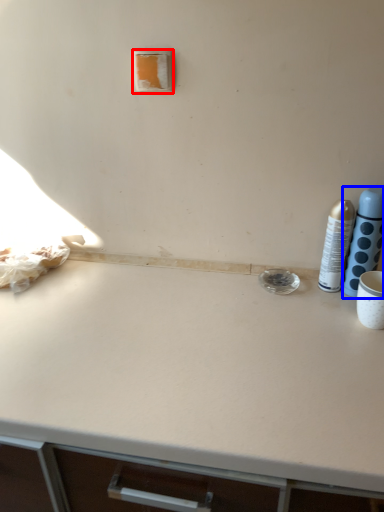
Question: Which object appears closest to the camera in this image, light switch (highlighted by a red box) or bottle (highlighted by a blue box)?

Choices:
 (A) light switch
 (B) bottle

Answer: (B)